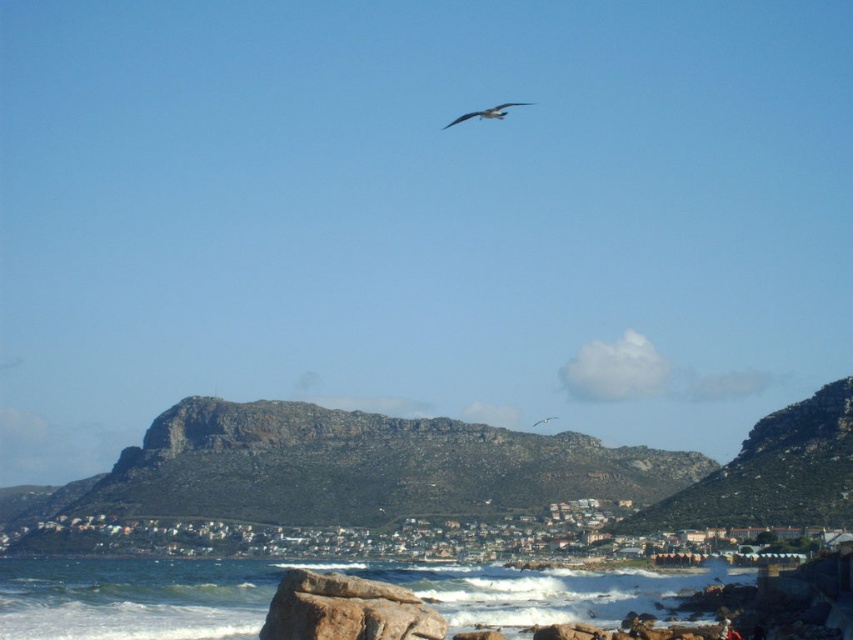
Question: Is clear water at lower center to the left of white feathered bird at upper center from the viewer's perspective?

Choices:
 (A) yes
 (B) no

Answer: (A)

Question: Which of the following is the closest to the observer?

Choices:
 (A) brown rough rock at lower center
 (B) clear water at lower center
 (C) gray feathered bird at upper center
 (D) white feathered bird at upper center

Answer: (A)

Question: Is clear water at lower center wider than brown rough rock at lower center?

Choices:
 (A) yes
 (B) no

Answer: (A)

Question: Estimate the real-world distances between objects in this image. Which object is closer to the white feathered bird at upper center?

Choices:
 (A) brown rough rock at lower center
 (B) gray feathered bird at upper center
 (C) clear water at lower center

Answer: (B)

Question: Which point is closer to the camera?

Choices:
 (A) clear water at lower center
 (B) brown rough rock at lower center
 (C) gray feathered bird at upper center
 (D) white feathered bird at upper center

Answer: (B)

Question: Where is clear water at lower center located in relation to gray feathered bird at upper center in the image?

Choices:
 (A) right
 (B) left

Answer: (B)